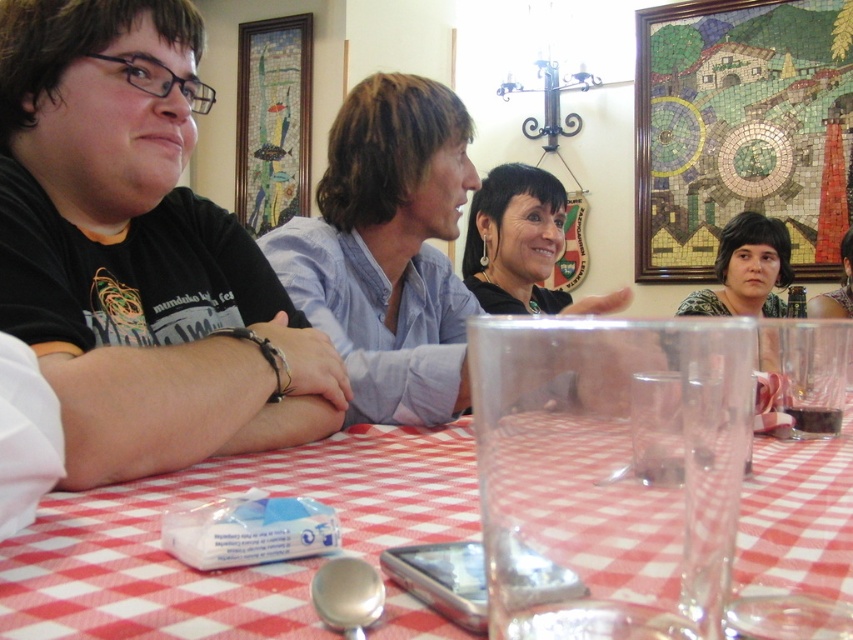
Does black matte shirt at left have a lesser height compared to green floral blouse at center?

No, black matte shirt at left is not shorter than green floral blouse at center.

Is point (213, 348) positioned behind point (744, 259)?

No, it is not.

Is point (253, 349) positioned before point (781, 257)?

Yes, it is in front of point (781, 257).

You are a GUI agent. You are given a task and a screenshot of the screen. Output one action in this format:
    pyautogui.click(x=<x>, y=<y>)
    Task: Click on the black matte shirt at left
    
    Given the screenshot: What is the action you would take?
    pyautogui.click(x=138, y=252)

Between red checkered tablecloth at center and matte black hair at center, which one is positioned lower?

red checkered tablecloth at center

Between red checkered tablecloth at center and matte black hair at center, which one has more height?

Standing taller between the two is matte black hair at center.

Does point (364, 470) come behind point (498, 294)?

No, (364, 470) is in front of (498, 294).

The height and width of the screenshot is (640, 853). Identify the location of red checkered tablecloth at center. (230, 570).

Who is more distant from viewer, [144,204] or [486,259]?

The point [486,259] is behind.

Is black matte shirt at left smaller than matte black hair at center?

Correct, black matte shirt at left occupies less space than matte black hair at center.

Between point (55, 12) and point (550, 212), which one is positioned in front?

Point (55, 12) is in front.

Locate an element on the screen. The width and height of the screenshot is (853, 640). black matte shirt at left is located at coordinates (138, 252).